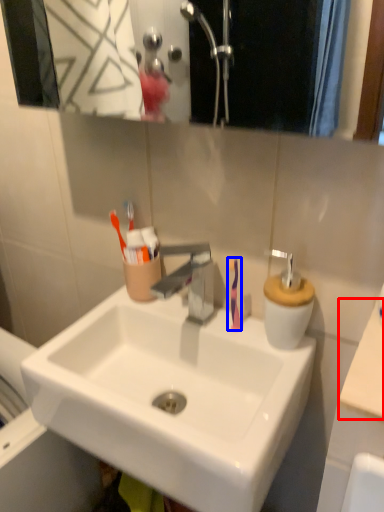
Question: Among these objects, which one is nearest to the camera, counter top (highlighted by a red box) or toothbrush (highlighted by a blue box)?

Choices:
 (A) counter top
 (B) toothbrush

Answer: (A)